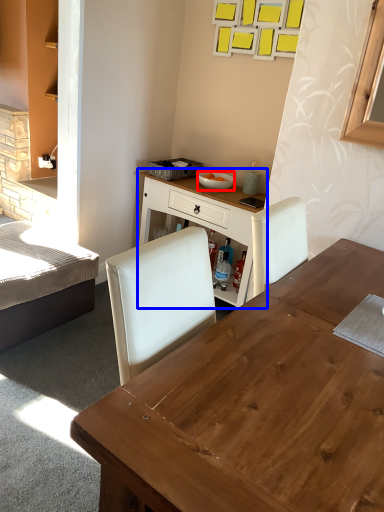
Question: Among these objects, which one is farthest to the camera, bowl (highlighted by a red box) or table (highlighted by a blue box)?

Choices:
 (A) bowl
 (B) table

Answer: (A)